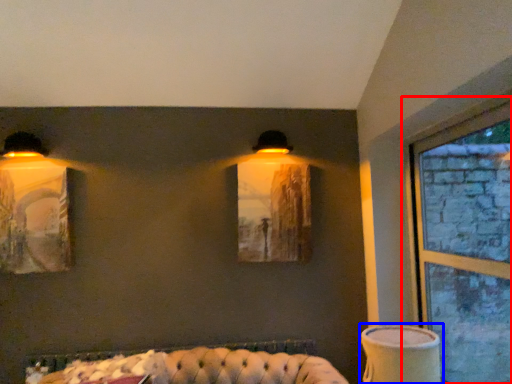
Question: Among these objects, which one is nearest to the camera, window (highlighted by a red box) or table lamp (highlighted by a blue box)?

Choices:
 (A) window
 (B) table lamp

Answer: (A)